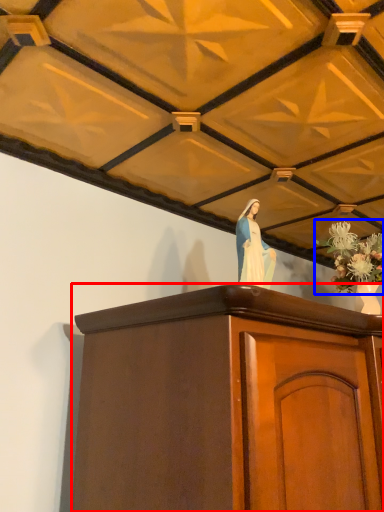
Question: Among these objects, which one is nearest to the camera, furniture (highlighted by a red box) or floral arrangement (highlighted by a blue box)?

Choices:
 (A) furniture
 (B) floral arrangement

Answer: (A)